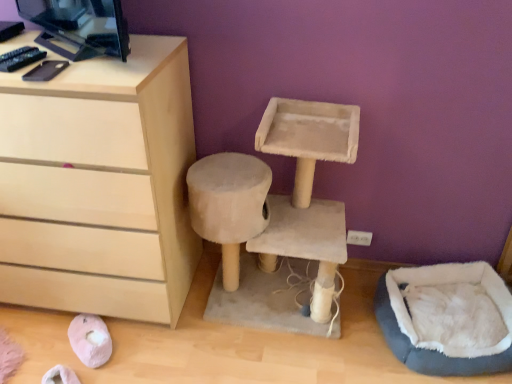
What do you see at coordinates (431, 350) in the screenshot?
I see `blue fuzzy bean bag at lower right` at bounding box center [431, 350].

Identify the location of beige fabric cat tree at center. (291, 226).

The height and width of the screenshot is (384, 512). What do you see at coordinates (100, 185) in the screenshot?
I see `light wood chest of drawers at left` at bounding box center [100, 185].

This screenshot has height=384, width=512. What are the coordinates of `black glossy desktop computer at upper left` in the screenshot? It's located at (79, 26).

Is point (86, 18) closer or farther from the camera than point (498, 370)?

Point (86, 18) is positioned closer to the camera compared to point (498, 370).

Based on the photo, would you consider black glossy desktop computer at upper left to be distant from blue fuzzy bean bag at lower right?

Yes.

Visually, is black glossy desktop computer at upper left positioned to the left or to the right of blue fuzzy bean bag at lower right?

Clearly, black glossy desktop computer at upper left is on the left of blue fuzzy bean bag at lower right in the image.

At what (x,y) coordinates should I click in order to perform the action: click on desktop computer located on the left of blue fuzzy bean bag at lower right. Please return your answer as a coordinate pair (x, y). Looking at the image, I should click on (79, 26).

From a real-world perspective, does blue fuzzy bean bag at lower right stand above black glossy desktop computer at upper left?

Actually, blue fuzzy bean bag at lower right is physically below black glossy desktop computer at upper left in the real world.

Considering the points (454, 375) and (93, 4), which point is in front, point (454, 375) or point (93, 4)?

Positioned in front is point (93, 4).

Is blue fuzzy bean bag at lower right positioned with its back to black glossy desktop computer at upper left?

That's not correct — blue fuzzy bean bag at lower right is not looking away from black glossy desktop computer at upper left.

What's the angular difference between beige fabric cat tree at center and light wood chest of drawers at left's facing directions?

0.0325 degrees.

Can you see beige fabric cat tree at center touching light wood chest of drawers at left?

beige fabric cat tree at center and light wood chest of drawers at left are not in contact.

Can light wood chest of drawers at left be found inside beige fabric cat tree at center?

That's incorrect, light wood chest of drawers at left is not inside beige fabric cat tree at center.

Between beige fabric cat tree at center and light wood chest of drawers at left, which one has larger size?

Bigger between the two is light wood chest of drawers at left.

Which object is positioned more to the left, blue fuzzy bean bag at lower right or beige fabric cat tree at center?

From the viewer's perspective, beige fabric cat tree at center appears more on the left side.

How different are the orientations of blue fuzzy bean bag at lower right and beige fabric cat tree at center in degrees?

blue fuzzy bean bag at lower right and beige fabric cat tree at center are facing 13.1 degrees away from each other.

Considering the sizes of objects blue fuzzy bean bag at lower right and beige fabric cat tree at center in the image provided, who is bigger, blue fuzzy bean bag at lower right or beige fabric cat tree at center?

Bigger between the two is beige fabric cat tree at center.

Considering the sizes of objects blue fuzzy bean bag at lower right and beige fabric cat tree at center in the image provided, who is shorter, blue fuzzy bean bag at lower right or beige fabric cat tree at center?

With less height is blue fuzzy bean bag at lower right.

From the image's perspective, is light wood chest of drawers at left over beige fabric cat tree at center?

Yes, from the image's perspective, light wood chest of drawers at left is over beige fabric cat tree at center.

Is light wood chest of drawers at left positioned with its back to beige fabric cat tree at center?

light wood chest of drawers at left is not turned away from beige fabric cat tree at center.

Find the location of `chest of drawers above the beige fabric cat tree at center (from the image's perspective)`. chest of drawers above the beige fabric cat tree at center (from the image's perspective) is located at coordinates (100, 185).

Does beige fabric cat tree at center have a lesser height compared to black glossy desktop computer at upper left?

Incorrect, the height of beige fabric cat tree at center does not fall short of that of black glossy desktop computer at upper left.

From a real-world perspective, who is located higher, beige fabric cat tree at center or black glossy desktop computer at upper left?

In real-world perspective, black glossy desktop computer at upper left is above.

Based on their sizes in the image, would you say beige fabric cat tree at center is bigger or smaller than black glossy desktop computer at upper left?

beige fabric cat tree at center is bigger than black glossy desktop computer at upper left.

Is beige fabric cat tree at center at the right side of black glossy desktop computer at upper left?

Correct, you'll find beige fabric cat tree at center to the right of black glossy desktop computer at upper left.

In the scene shown: Can we say black glossy desktop computer at upper left lies outside beige fabric cat tree at center?

black glossy desktop computer at upper left lies outside beige fabric cat tree at center's area.

Which is in front, point (75, 16) or point (323, 271)?

The point (75, 16) is in front.

Considering the relative sizes of black glossy desktop computer at upper left and beige fabric cat tree at center in the image provided, is black glossy desktop computer at upper left bigger than beige fabric cat tree at center?

No, black glossy desktop computer at upper left is not bigger than beige fabric cat tree at center.

Which object is positioned more to the left, black glossy desktop computer at upper left or beige fabric cat tree at center?

black glossy desktop computer at upper left.

Locate an element on the screen. This screenshot has width=512, height=384. bean bag chair that is behind the black glossy desktop computer at upper left is located at coordinates (431, 350).

The height and width of the screenshot is (384, 512). I want to click on desktop computer that is in front of the blue fuzzy bean bag at lower right, so click(79, 26).

Looking at the image, which one is located further to black glossy desktop computer at upper left, blue fuzzy bean bag at lower right or beige fabric cat tree at center?

The object further to black glossy desktop computer at upper left is blue fuzzy bean bag at lower right.

Which object lies nearer to the anchor point black glossy desktop computer at upper left, light wood chest of drawers at left or blue fuzzy bean bag at lower right?

Based on the image, light wood chest of drawers at left appears to be nearer to black glossy desktop computer at upper left.

Which object lies nearer to the anchor point beige fabric cat tree at center, blue fuzzy bean bag at lower right or black glossy desktop computer at upper left?

The object closer to beige fabric cat tree at center is blue fuzzy bean bag at lower right.

Looking at the image, which one is located closer to beige fabric cat tree at center, black glossy desktop computer at upper left or light wood chest of drawers at left?

light wood chest of drawers at left.

Considering their positions, is blue fuzzy bean bag at lower right positioned further to beige fabric cat tree at center than light wood chest of drawers at left?

Based on the image, blue fuzzy bean bag at lower right appears to be further to beige fabric cat tree at center.

Which object lies further to the anchor point light wood chest of drawers at left, beige fabric cat tree at center or black glossy desktop computer at upper left?

beige fabric cat tree at center lies further to light wood chest of drawers at left than the other object.

From the image, which object appears to be farther from beige fabric cat tree at center, light wood chest of drawers at left or black glossy desktop computer at upper left?

The object further to beige fabric cat tree at center is black glossy desktop computer at upper left.

Considering their positions, is light wood chest of drawers at left positioned further to blue fuzzy bean bag at lower right than black glossy desktop computer at upper left?

Among the two, black glossy desktop computer at upper left is located further to blue fuzzy bean bag at lower right.

The image size is (512, 384). In order to click on computer desk situated between light wood chest of drawers at left and blue fuzzy bean bag at lower right from left to right in this screenshot , I will do `click(291, 226)`.

Where is `desktop computer situated between light wood chest of drawers at left and beige fabric cat tree at center from left to right`? The width and height of the screenshot is (512, 384). desktop computer situated between light wood chest of drawers at left and beige fabric cat tree at center from left to right is located at coordinates (79, 26).

Locate an element on the screen. desktop computer situated between light wood chest of drawers at left and blue fuzzy bean bag at lower right from left to right is located at coordinates (79, 26).

The image size is (512, 384). What are the coordinates of `computer desk between black glossy desktop computer at upper left and blue fuzzy bean bag at lower right` in the screenshot? It's located at click(291, 226).